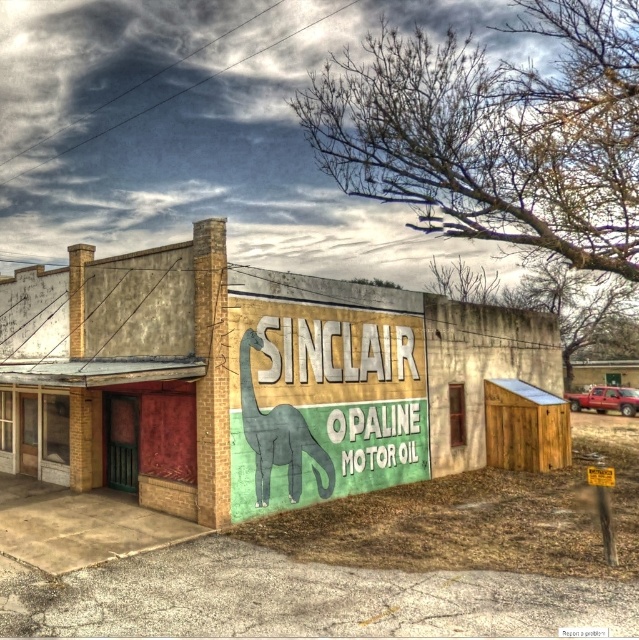
You are a delivery person who needs to load a box onto a 1.8 meter high shelf in the garage. You have the green matte sign at center and the gray matte dinosaur at center in your way. Which object do you need to move to make space?

The green matte sign at center is shorter than the gray matte dinosaur at center, so you need to move the gray matte dinosaur at center to make space since it is taller.

You are a delivery driver who needs to park your truck in the parking lot near the Sinclair Oil station. You see the green matte sign at center and the gray matte dinosaur at center. Which object is closer to your truck if you park in the parking lot?

The green matte sign at center is closer to your truck because it is in front of the gray matte dinosaur at center, meaning it is positioned nearer to the parking lot area.